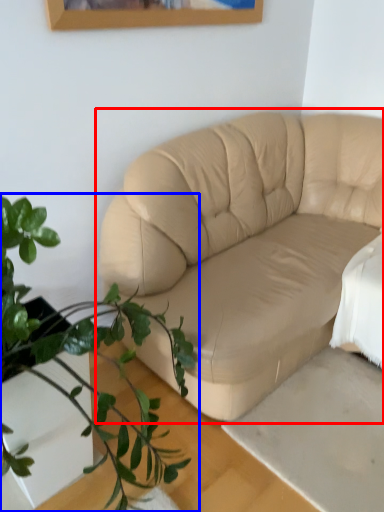
Question: Which point is closer to the camera, studio couch (highlighted by a red box) or houseplant (highlighted by a blue box)?

Choices:
 (A) studio couch
 (B) houseplant

Answer: (B)